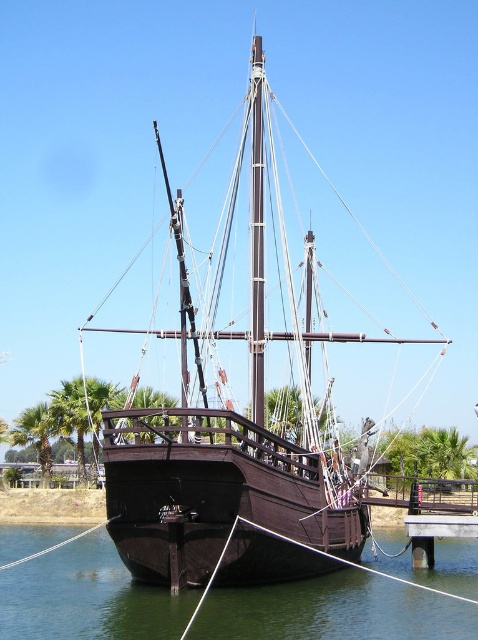
You are a sailor standing on the dock and want to board the brown wooden sailboat at center. The green water at lower center is currently at your waist level. Can you step onto the sailboat without getting your feet wet?

The brown wooden sailboat at center is much taller than the green water at lower center, so stepping onto it would keep your feet dry as the boat is elevated above the water level.

You are standing on the dock and want to locate the brown wooden sailboat at center. According to the coordinates given, in which direction should you look relative to your position on the dock?

The brown wooden sailboat at center is located at coordinates point (237, 419), so you should look towards the center of the dock where the coordinates indicate its position.